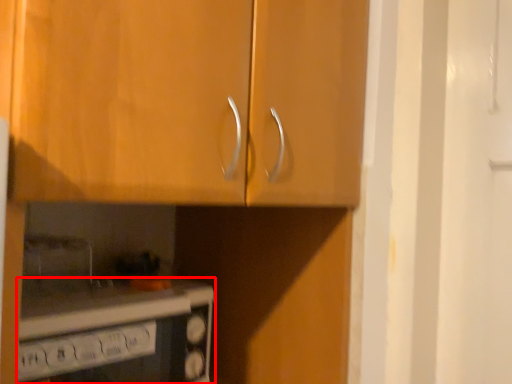
Question: From the image's perspective, considering the relative positions of home appliance (annotated by the red box) and cabinetry in the image provided, where is home appliance (annotated by the red box) located with respect to the staircase?

Choices:
 (A) above
 (B) below

Answer: (B)